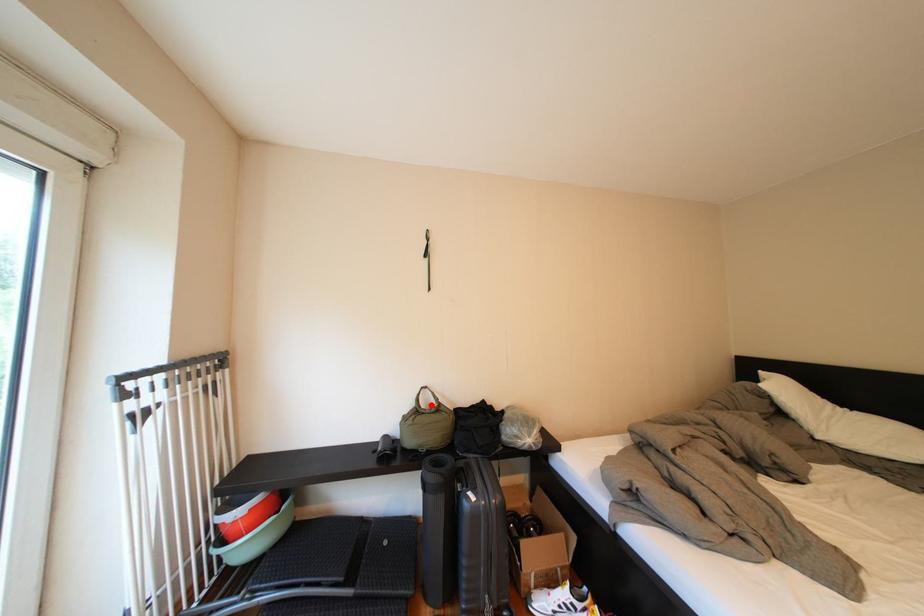
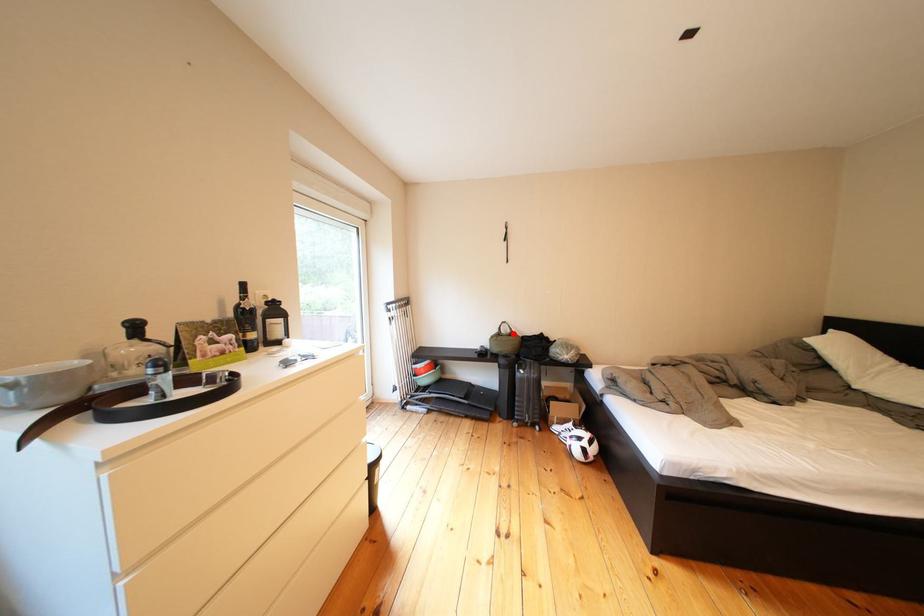
I am providing you with two images of the same scene from different viewpoints. A red point is marked on the first image and another point is marked on the second image. Is the marked point in image1 the same physical position as the marked point in image2?

Yes